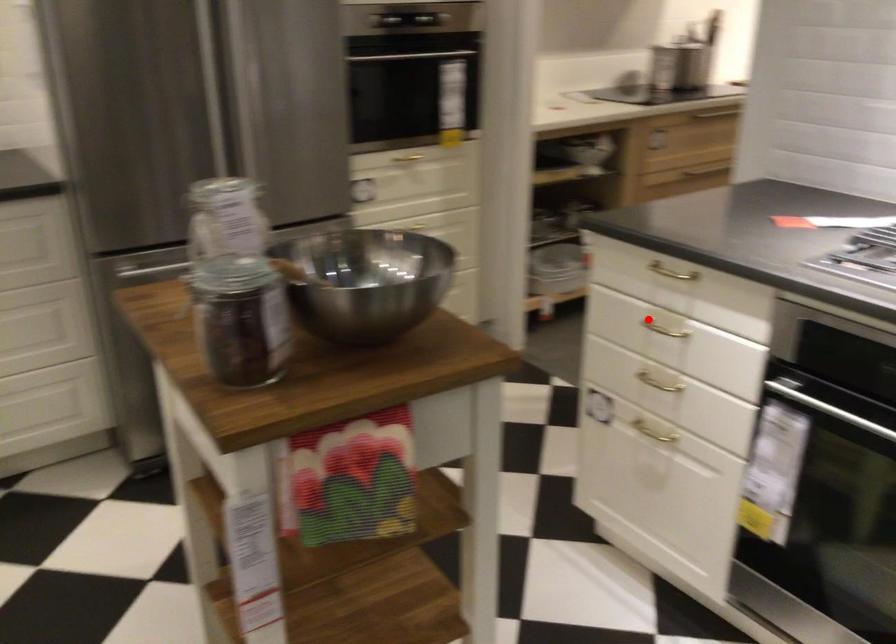
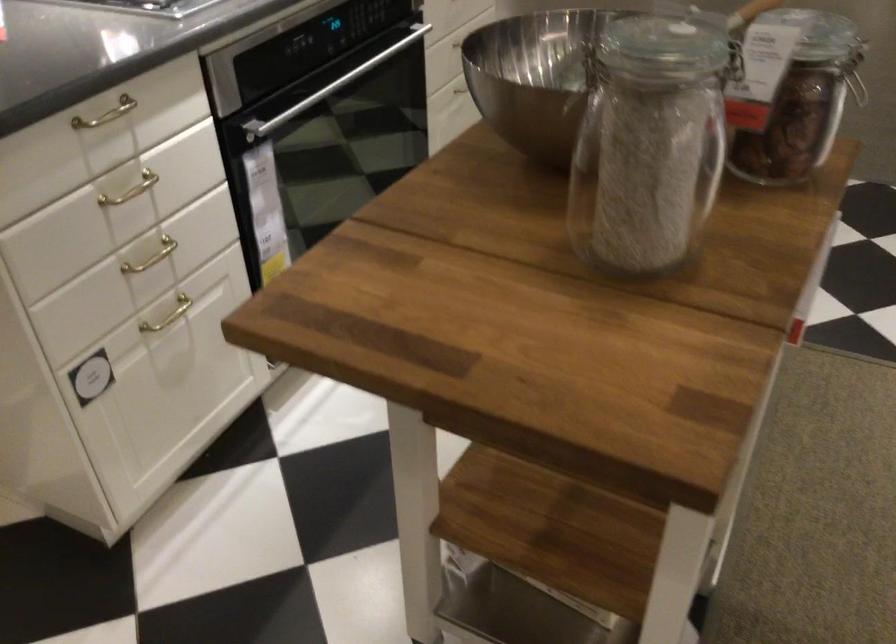
Question: I am providing you with two images of the same scene from different viewpoints. Given a red point in image1, look at the same physical point in image2. Is it:

Choices:
 (A) Closer to the viewpoint
 (B) Farther from the viewpoint

Answer: (A)